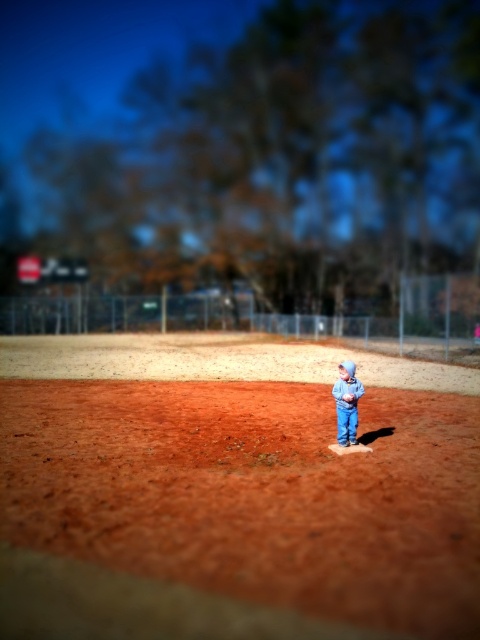
Between brown dirt field at center and blue denim pants at center, which one is positioned lower?

brown dirt field at center is lower down.

Does brown dirt field at center have a lesser height compared to blue denim pants at center?

Indeed, brown dirt field at center has a lesser height compared to blue denim pants at center.

Image resolution: width=480 pixels, height=640 pixels. Describe the element at coordinates (233, 490) in the screenshot. I see `brown dirt field at center` at that location.

Locate an element on the screen. This screenshot has height=640, width=480. brown dirt field at center is located at coordinates (233, 490).